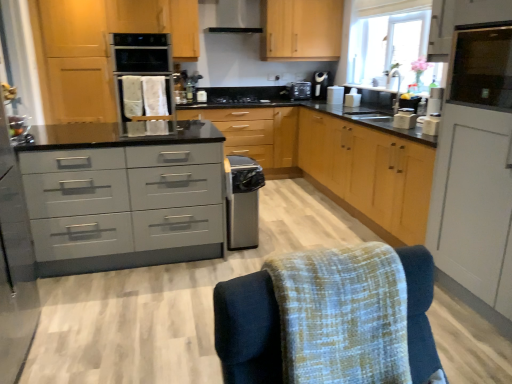
Question: Is wooden cabinet at center, the third cabinetry positioned from the right, outside of transparent glass window screen at upper right?

Choices:
 (A) yes
 (B) no

Answer: (A)

Question: Is transparent glass window screen at upper right at the back of wooden cabinet at center, the 1th cabinetry in the back-to-front sequence?

Choices:
 (A) no
 (B) yes

Answer: (A)

Question: Is wooden cabinet at center, the 1th cabinetry in the back-to-front sequence, oriented towards transparent glass window screen at upper right?

Choices:
 (A) no
 (B) yes

Answer: (B)

Question: Can you confirm if wooden cabinet at center, the fourth cabinetry positioned from the front, is taller than transparent glass window screen at upper right?

Choices:
 (A) no
 (B) yes

Answer: (B)

Question: From a real-world perspective, is wooden cabinet at center, the 1th cabinetry in the back-to-front sequence, physically above transparent glass window screen at upper right?

Choices:
 (A) yes
 (B) no

Answer: (B)

Question: Does wooden cabinet at center, positioned as the second cabinetry in left-to-right order, have a smaller size compared to transparent glass window screen at upper right?

Choices:
 (A) yes
 (B) no

Answer: (B)

Question: Is wooden cabinet at center, the 1th cabinetry in the back-to-front sequence, wider than matte wood cabinet at upper right, positioned as the second cabinetry in right-to-left order?

Choices:
 (A) no
 (B) yes

Answer: (B)

Question: Is wooden cabinet at center, the 1th cabinetry in the back-to-front sequence, not within matte wood cabinet at upper right, which is the third cabinetry from back to front?

Choices:
 (A) yes
 (B) no

Answer: (A)

Question: Is wooden cabinet at center, the third cabinetry positioned from the right, turned away from matte wood cabinet at upper right, the 2th cabinetry when ordered from front to back?

Choices:
 (A) no
 (B) yes

Answer: (A)

Question: Would you say wooden cabinet at center, the third cabinetry positioned from the right, is a long distance from matte wood cabinet at upper right, acting as the 3th cabinetry starting from the left?

Choices:
 (A) yes
 (B) no

Answer: (A)

Question: From the image's perspective, is wooden cabinet at center, positioned as the second cabinetry in left-to-right order, over matte wood cabinet at upper right, which is the third cabinetry from back to front?

Choices:
 (A) yes
 (B) no

Answer: (B)

Question: Can matte wood cabinet at upper right, the 2th cabinetry when ordered from front to back, be found inside wooden cabinet at center, the 1th cabinetry in the back-to-front sequence?

Choices:
 (A) yes
 (B) no

Answer: (B)

Question: Is textured fabric swivel chair at lower right touching matte gray drawers at center?

Choices:
 (A) yes
 (B) no

Answer: (B)